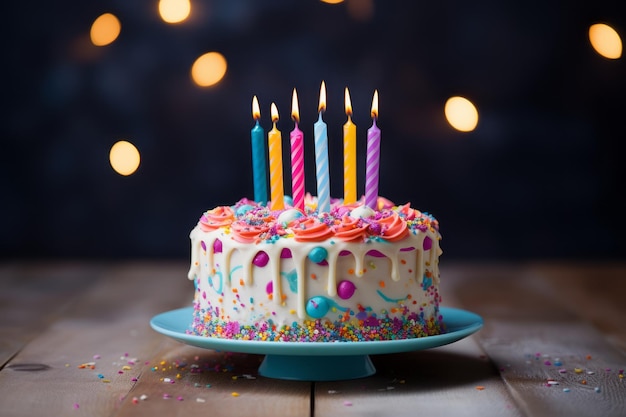
This screenshot has width=626, height=417. I want to click on candle flame, so point(257,110), point(275,116), point(293,109), point(320,103), point(350,103), point(377,106).